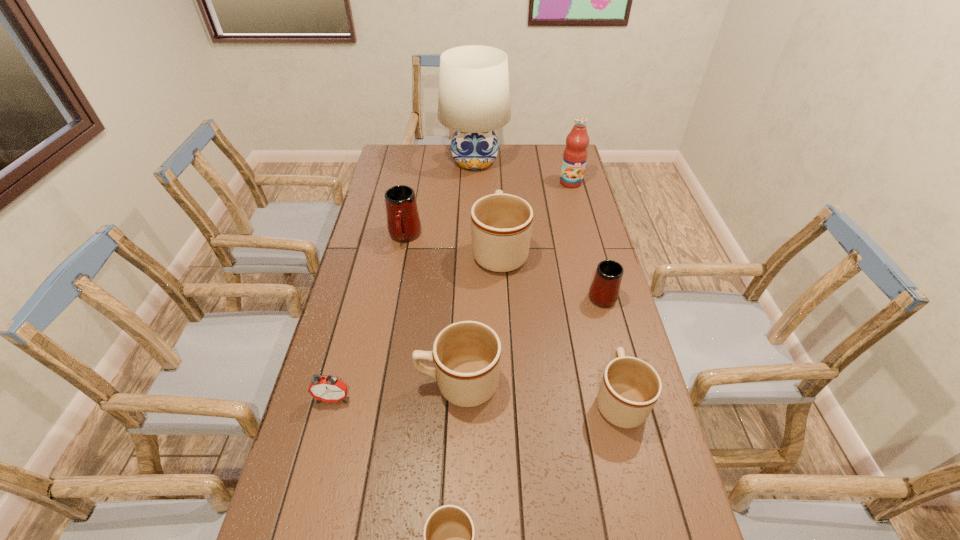
The width and height of the screenshot is (960, 540). Identify the location of the tallest object. (474, 97).

Find the location of a particular element. This screenshot has width=960, height=540. lampshade is located at coordinates (474, 97).

You are a GUI agent. You are given a task and a screenshot of the screen. Output one action in this format:
    pyautogui.click(x=<x>, y=<y>)
    Task: Click on the second tallest object
    Image resolution: width=960 pixels, height=540 pixels.
    Given the screenshot: What is the action you would take?
    pyautogui.click(x=575, y=153)

At what (x,y) coordinates should I click in order to perform the action: click on the biggest brown mug. Please return your answer as a coordinate pair (x, y). The width and height of the screenshot is (960, 540). Looking at the image, I should click on (501, 224).

Where is `the farther red mug`? the farther red mug is located at coordinates (403, 222).

Where is `the leftmost mug`? This screenshot has width=960, height=540. the leftmost mug is located at coordinates 403,222.

Locate an element on the screen. This screenshot has width=960, height=540. the second biggest brown mug is located at coordinates (466, 354).

Locate an element on the screen. The height and width of the screenshot is (540, 960). the rightmost brown mug is located at coordinates (630, 387).

The height and width of the screenshot is (540, 960). What are the coordinates of `the smaller red mug` in the screenshot? It's located at (604, 290).

Where is `the fifth nearest object`? Image resolution: width=960 pixels, height=540 pixels. the fifth nearest object is located at coordinates (604, 290).